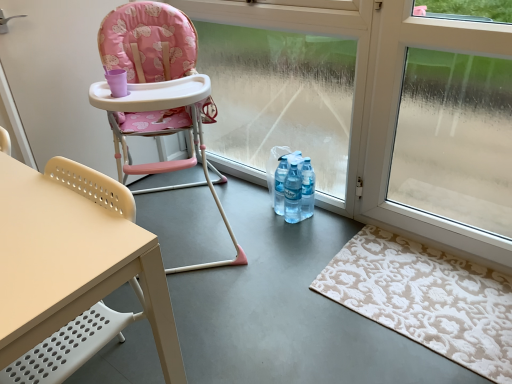
This screenshot has width=512, height=384. What are the coordinates of `free point in front of transparent glass window at lower right` in the screenshot? It's located at (448, 319).